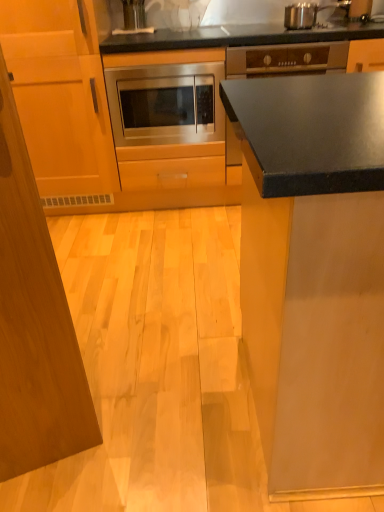
Question: Is stainless steel microwave at center, the 1th cabinetry positioned from the right, outside of wooden cabinet at left, which is counted as the 1th cabinetry, starting from the left?

Choices:
 (A) no
 (B) yes

Answer: (B)

Question: Is stainless steel microwave at center, the 1th cabinetry positioned from the right, looking in the opposite direction of wooden cabinet at left, which is the 2th cabinetry from right to left?

Choices:
 (A) yes
 (B) no

Answer: (B)

Question: Does stainless steel microwave at center, which is the 2th cabinetry from left to right, come behind wooden cabinet at left, which is the 2th cabinetry from right to left?

Choices:
 (A) yes
 (B) no

Answer: (A)

Question: Can you confirm if stainless steel microwave at center, which is the 2th cabinetry from left to right, is taller than wooden cabinet at left, which is counted as the 1th cabinetry, starting from the left?

Choices:
 (A) no
 (B) yes

Answer: (A)

Question: Is stainless steel microwave at center, the 1th cabinetry positioned from the right, closer to camera compared to wooden cabinet at left, which is counted as the 1th cabinetry, starting from the left?

Choices:
 (A) yes
 (B) no

Answer: (B)

Question: Choose the correct answer: Is matte black countertop at upper right inside wooden cabinet at left, which is the 2th cabinetry from right to left, or outside it?

Choices:
 (A) inside
 (B) outside

Answer: (B)

Question: Is matte black countertop at upper right to the left or to the right of wooden cabinet at left, which is the 2th cabinetry from right to left, in the image?

Choices:
 (A) right
 (B) left

Answer: (A)

Question: Is point (379, 79) positioned closer to the camera than point (29, 111)?

Choices:
 (A) closer
 (B) farther

Answer: (A)

Question: Looking at the image, does matte black countertop at upper right seem bigger or smaller compared to wooden cabinet at left, which is counted as the 1th cabinetry, starting from the left?

Choices:
 (A) small
 (B) big

Answer: (A)

Question: From a real-world perspective, relative to stainless steel microwave at center, which is the 2th cabinetry from left to right, is matte black countertop at upper right vertically above or below?

Choices:
 (A) above
 (B) below

Answer: (A)

Question: Is matte black countertop at upper right wider or thinner than stainless steel microwave at center, which is the 2th cabinetry from left to right?

Choices:
 (A) wide
 (B) thin

Answer: (B)

Question: Is point (344, 132) closer or farther from the camera than point (26, 10)?

Choices:
 (A) farther
 (B) closer

Answer: (B)

Question: From the image's perspective, relative to stainless steel microwave at center, the 1th cabinetry positioned from the right, is matte black countertop at upper right above or below?

Choices:
 (A) above
 (B) below

Answer: (A)

Question: Based on their sizes in the image, would you say stainless steel microwave at center is bigger or smaller than wooden cabinet at left, which is the 2th cabinetry from right to left?

Choices:
 (A) big
 (B) small

Answer: (B)

Question: Is stainless steel microwave at center in front of or behind wooden cabinet at left, which is the 2th cabinetry from right to left, in the image?

Choices:
 (A) behind
 (B) front

Answer: (A)